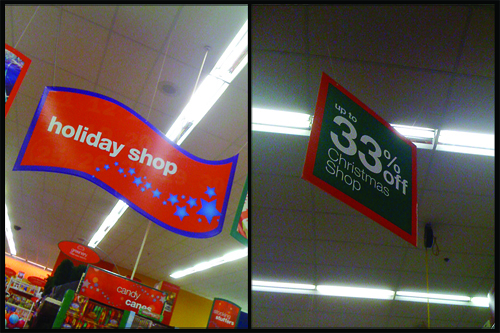
Identify the location of ceiling. (373, 251).